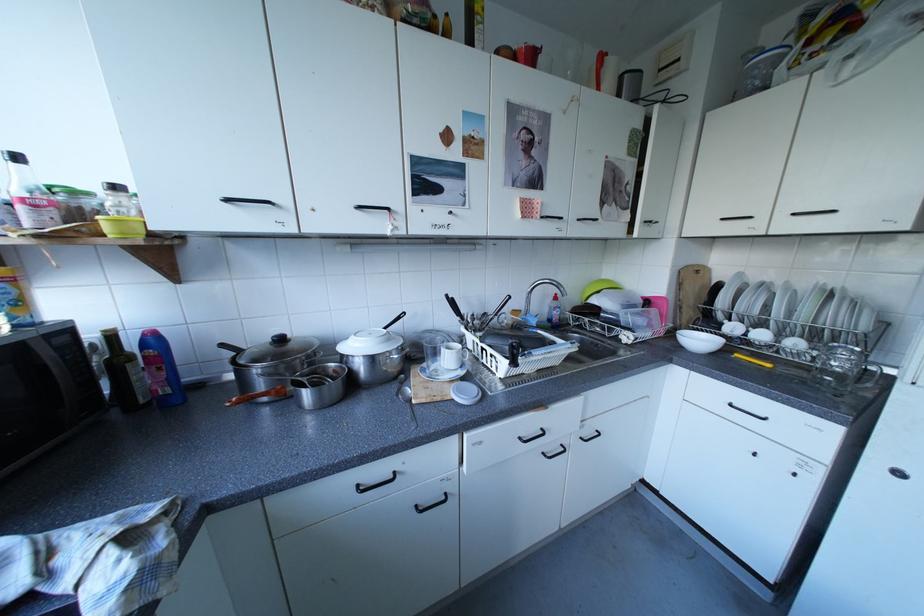
The image size is (924, 616). Describe the element at coordinates (258, 395) in the screenshot. I see `the orange pan handle` at that location.